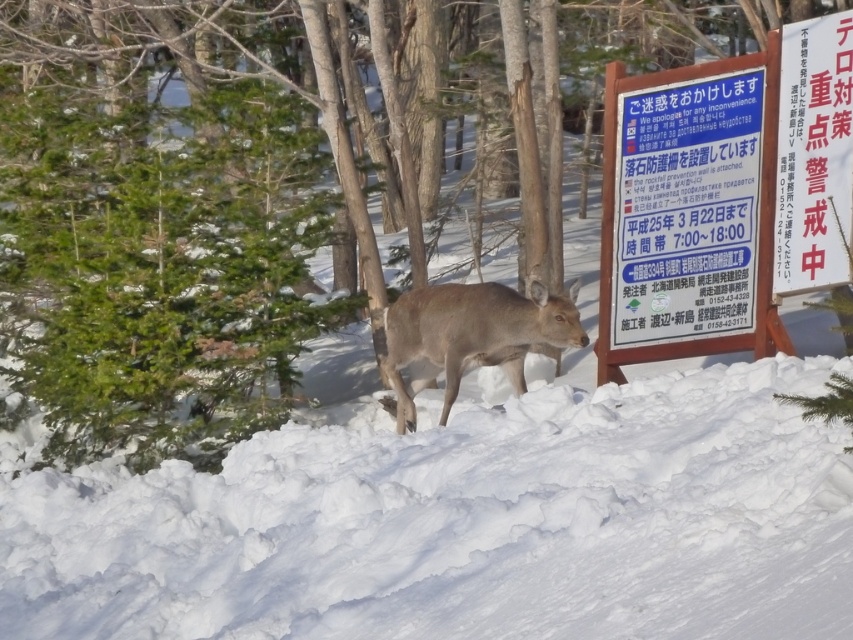
Who is lower down, white wooden sign at center-right or brown matte deer at center?

brown matte deer at center is below.

Does white wooden sign at center-right appear over brown matte deer at center?

Correct, white wooden sign at center-right is located above brown matte deer at center.

I want to click on white wooden sign at center-right, so click(717, 228).

This screenshot has height=640, width=853. What are the coordinates of `white wooden sign at center-right` in the screenshot? It's located at (717, 228).

Does white fluffy snow at center appear on the right side of brown matte deer at center?

Correct, you'll find white fluffy snow at center to the right of brown matte deer at center.

What do you see at coordinates (463, 524) in the screenshot? I see `white fluffy snow at center` at bounding box center [463, 524].

The width and height of the screenshot is (853, 640). Find the location of `white fluffy snow at center`. white fluffy snow at center is located at coordinates 463,524.

Measure the distance from white wooden sign at center-right to white paper sign at upper right.

white wooden sign at center-right is 26.92 inches away from white paper sign at upper right.

Image resolution: width=853 pixels, height=640 pixels. What are the coordinates of `white wooden sign at center-right` in the screenshot? It's located at (717, 228).

Is point (666, 339) positioned before point (839, 204)?

That is False.

The height and width of the screenshot is (640, 853). In order to click on white wooden sign at center-right in this screenshot , I will do `click(717, 228)`.